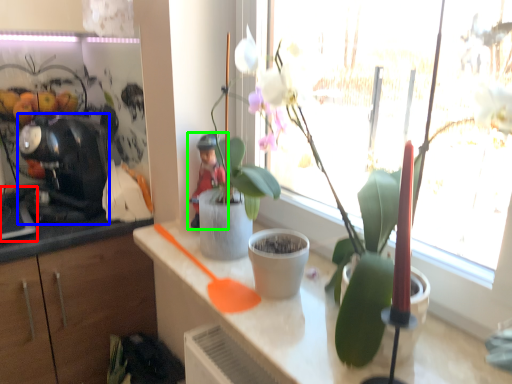
Question: Which object is the closest to the appliance (highlighted by a red box)? Choose among these: coffee machine (highlighted by a blue box) or person (highlighted by a green box).

Choices:
 (A) coffee machine
 (B) person

Answer: (A)